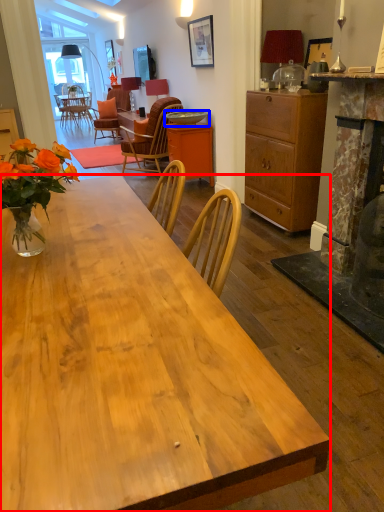
Question: Which point is further to the camera, desk (highlighted by a red box) or round table (highlighted by a blue box)?

Choices:
 (A) desk
 (B) round table

Answer: (B)